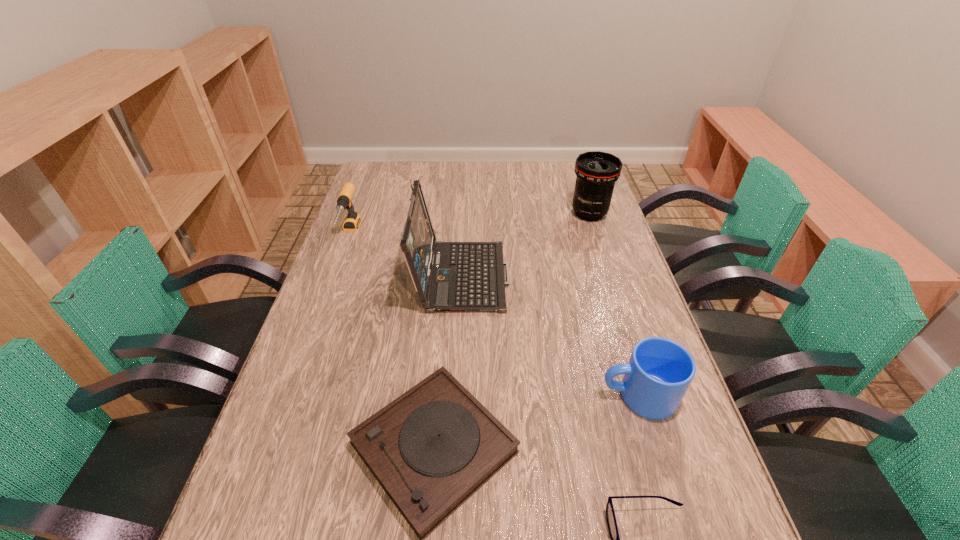
Select which object is the second closest to the drill. Please provide its 2D coordinates. Your answer should be formatted as a tuple, i.e. [(x, y)], where the tuple contains the x and y coordinates of a point satisfying the conditions above.

[(433, 447)]